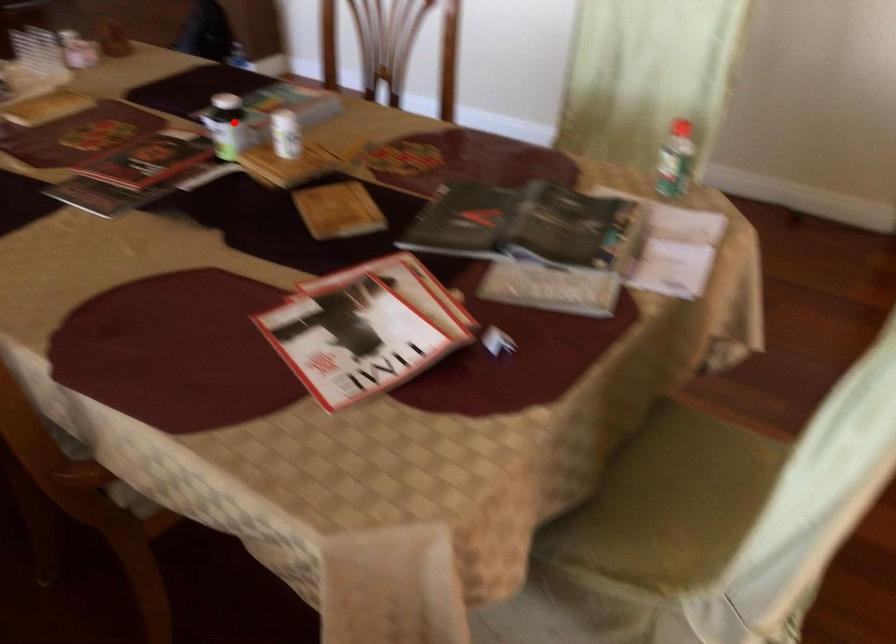
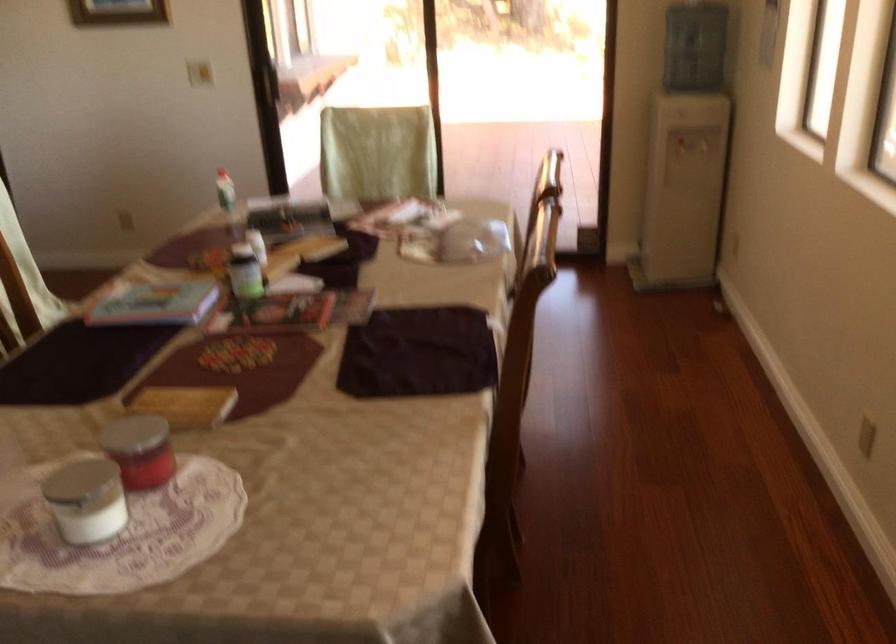
Locate, in the second image, the point that corresponds to the highlighted location in the first image.

(245, 272)